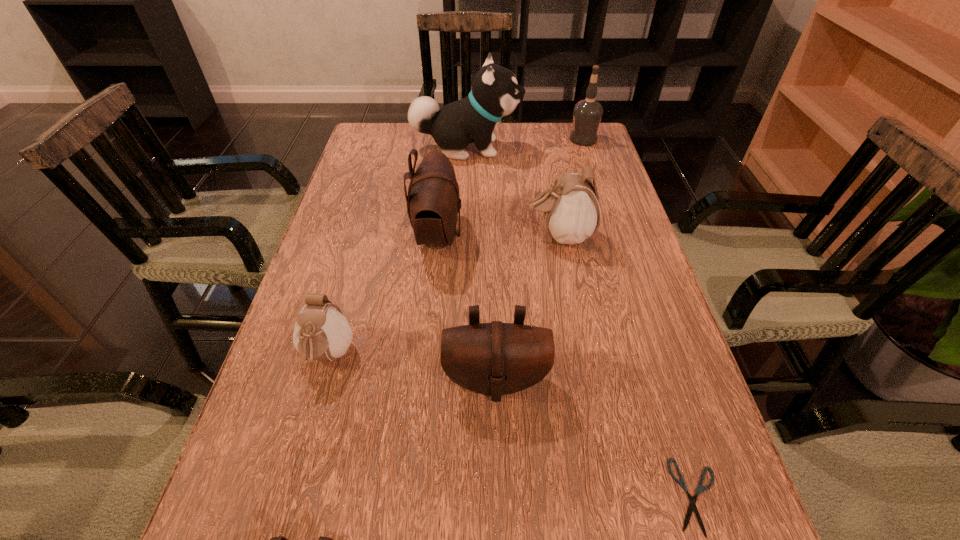
The width and height of the screenshot is (960, 540). Find the location of `vacant space at the right edge of the desktop`. vacant space at the right edge of the desktop is located at coordinates (617, 231).

Identify the location of free space at the far left corner of the desktop. click(376, 149).

Locate an element on the screen. The image size is (960, 540). empty space that is in between the farthest brown pouch and the smaller white pouch is located at coordinates (383, 296).

This screenshot has width=960, height=540. I want to click on vacant region between the biggest brown pouch and the shears, so click(567, 366).

What are the coordinates of `free point between the farther white pouch and the farthest brown pouch` in the screenshot? It's located at (499, 235).

Where is `vacant space in between the vodka and the second smallest brown pouch`? Image resolution: width=960 pixels, height=540 pixels. vacant space in between the vodka and the second smallest brown pouch is located at coordinates (540, 260).

At what (x,y) coordinates should I click in order to perform the action: click on free space between the bigger white pouch and the shortest object. Please return your answer as a coordinate pair (x, y). Looking at the image, I should click on (628, 366).

Identify the location of unoccupied area between the seventh farthest object and the bigger white pouch. (628, 366).

Image resolution: width=960 pixels, height=540 pixels. Find the location of `free space between the black shears and the farther white pouch`. free space between the black shears and the farther white pouch is located at coordinates (628, 366).

I want to click on vacant space in between the second biggest brown pouch and the white puppy, so click(x=481, y=264).